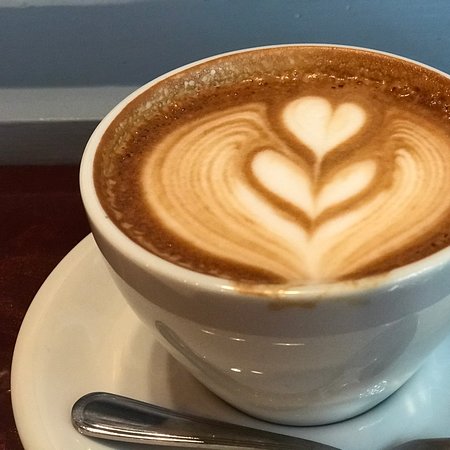
Find the location of a particular element. The width and height of the screenshot is (450, 450). white board along edge of countertop and wall is located at coordinates (51, 105).